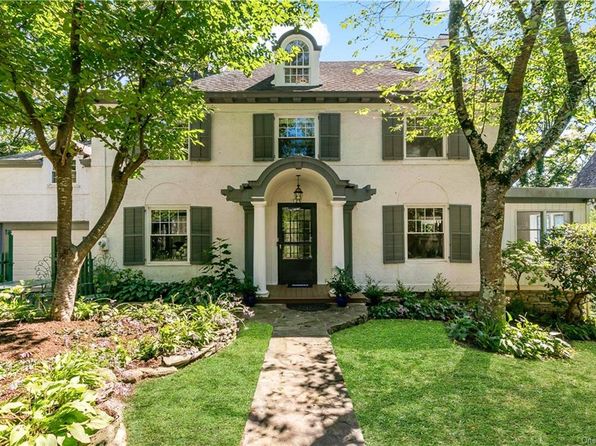
In order to click on small green plants in this screenshot , I will do `click(61, 418)`, `click(67, 373)`, `click(150, 347)`, `click(201, 327)`, `click(396, 307)`, `click(434, 306)`, `click(468, 329)`, `click(520, 344)`.